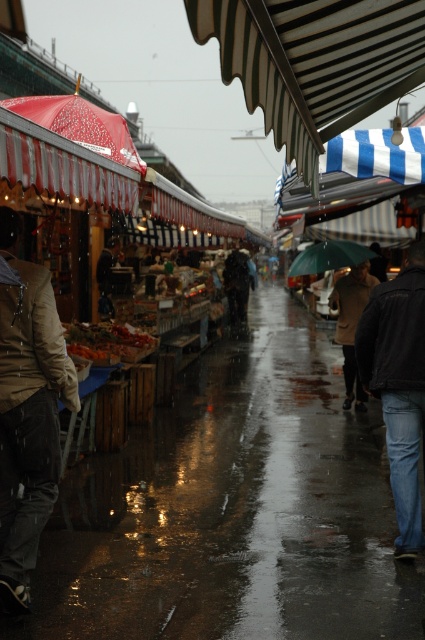
Question: Is white striped awning at upper center in front of red striped umbrella at upper left?

Choices:
 (A) no
 (B) yes

Answer: (B)

Question: Which point appears farthest from the camera in this image?

Choices:
 (A) pos(223,276)
 (B) pos(303,172)
 (C) pos(102,152)

Answer: (A)

Question: Which object is positioned closest to the red striped umbrella at upper left?

Choices:
 (A) white striped awning at upper center
 (B) tan leather jacket at left
 (C) green matte umbrella at center

Answer: (B)

Question: Does black leather jacket at lower right come in front of brown wool coat at center?

Choices:
 (A) yes
 (B) no

Answer: (A)

Question: Which is nearer to the tan leather jacket at left?

Choices:
 (A) brown wool coat at center
 (B) green matte umbrella at center

Answer: (B)

Question: Does red striped umbrella at upper left have a larger size compared to green matte umbrella at center?

Choices:
 (A) no
 (B) yes

Answer: (B)